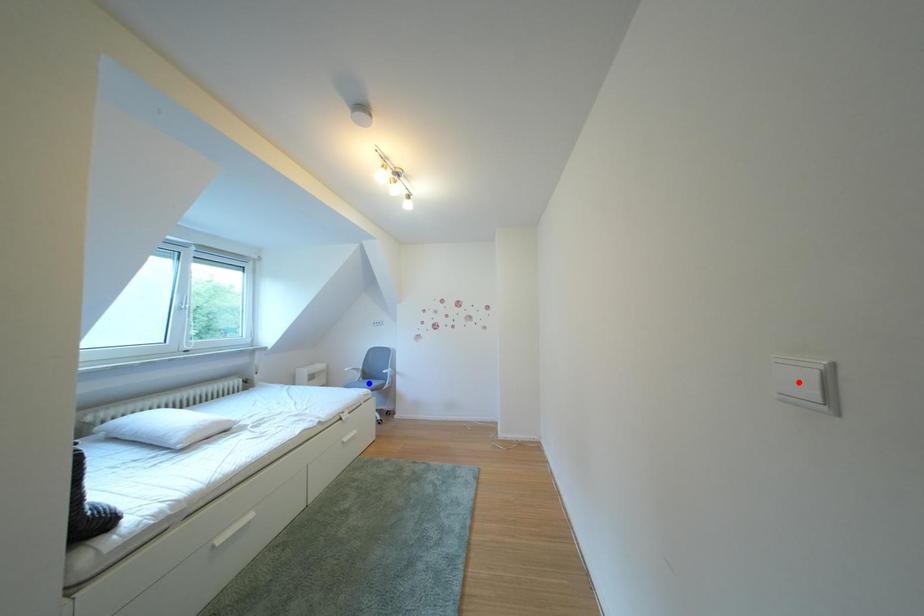
Question: Which of the two points in the image is closer to the camera?

Choices:
 (A) Blue point is closer.
 (B) Red point is closer.

Answer: (B)